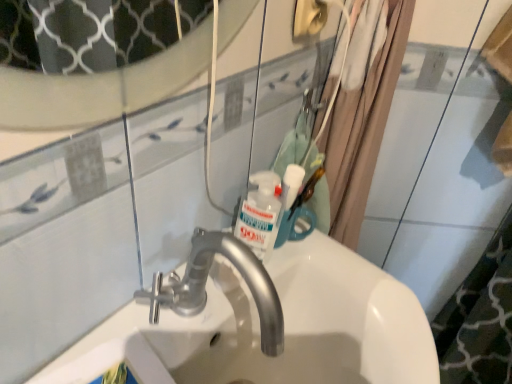
Question: Is white glossy sink at center inside the boundaries of beige fabric shower curtain at upper right, or outside?

Choices:
 (A) outside
 (B) inside

Answer: (A)

Question: From the image's perspective, is white glossy sink at center positioned above or below beige fabric shower curtain at upper right?

Choices:
 (A) above
 (B) below

Answer: (B)

Question: Which object is the farthest from the white glossy sink at center?

Choices:
 (A) white glossy mouthwash at upper center
 (B) beige fabric shower curtain at upper right

Answer: (B)

Question: Which of these objects is positioned closest to the white glossy mouthwash at upper center?

Choices:
 (A) beige fabric shower curtain at upper right
 (B) white glossy sink at center

Answer: (B)